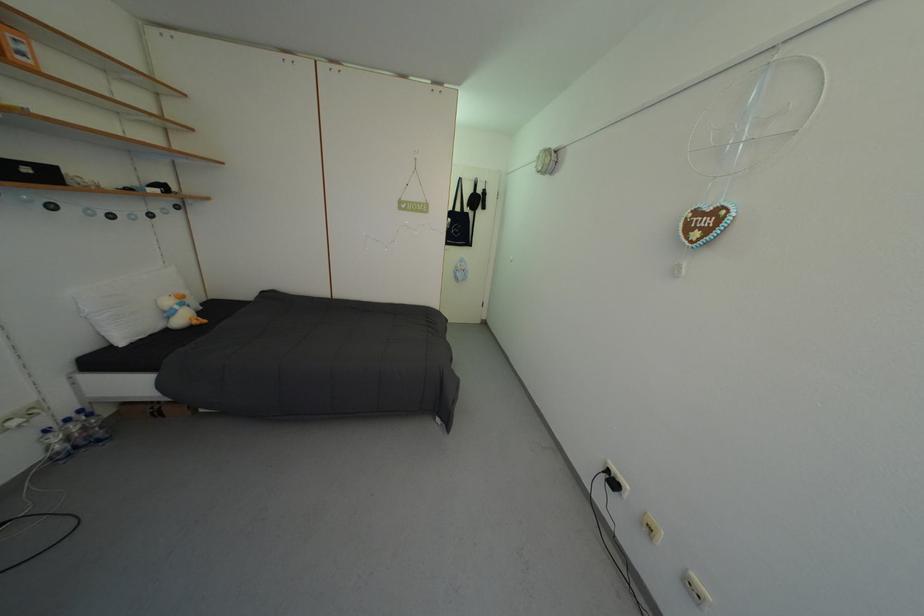
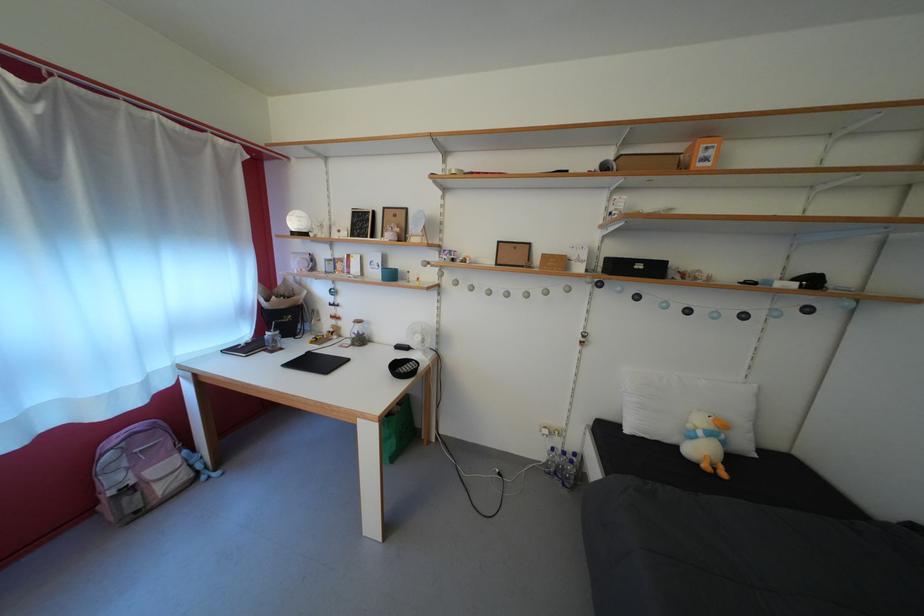
In the second image, find the point that corresponds to point (65, 459) in the first image.

(554, 472)